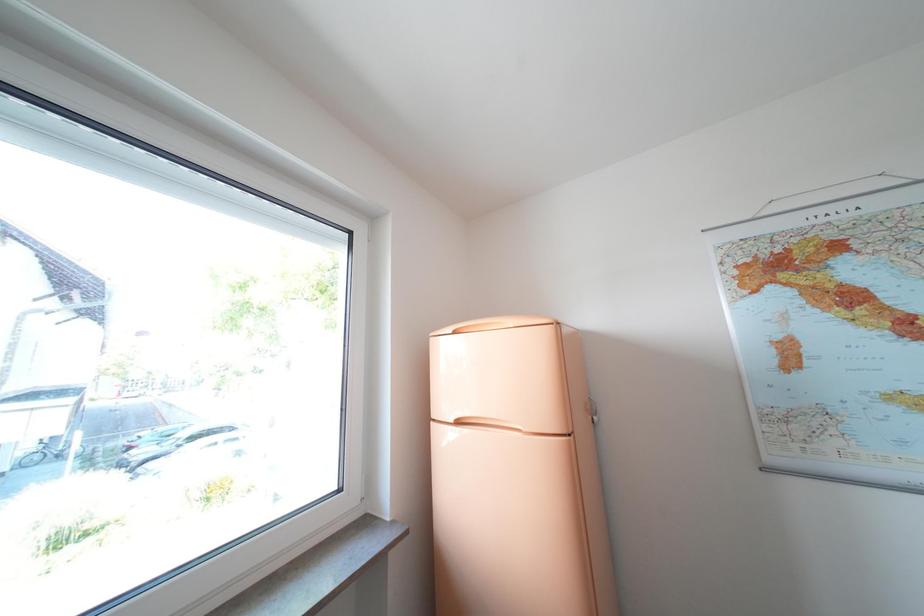
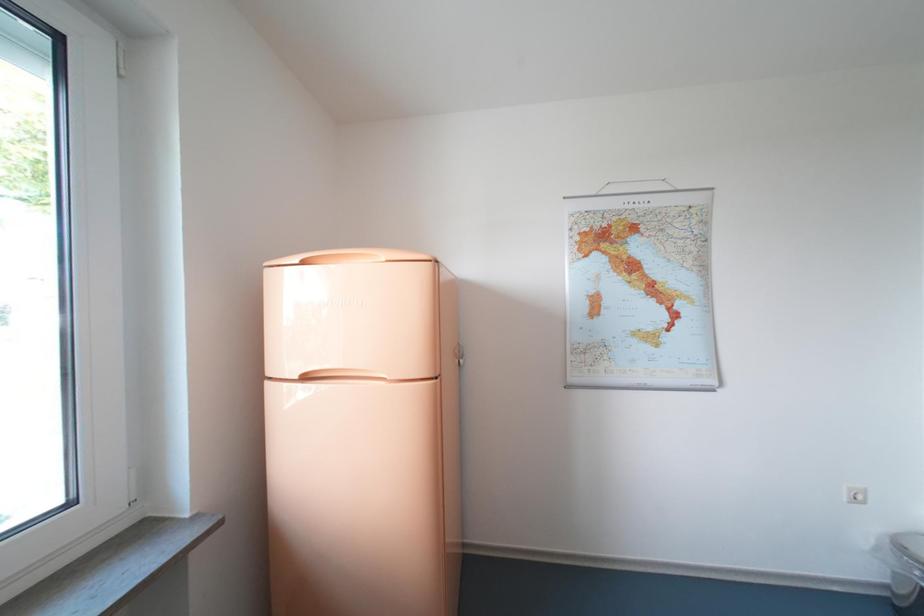
Question: How did the camera likely rotate?

Choices:
 (A) Left
 (B) Right
 (C) Up
 (D) Down

Answer: (B)